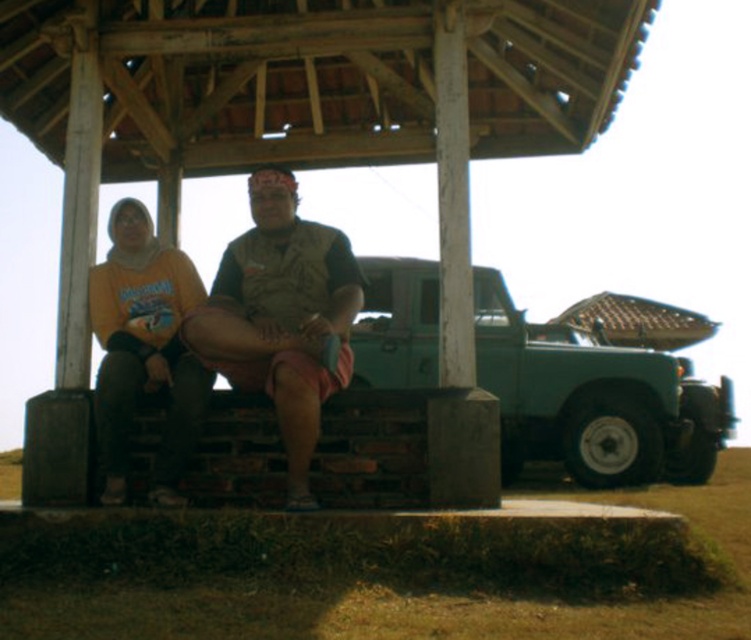
From the picture: Can you confirm if camouflage fabric shirt at center is shorter than matte yellow hoodie at left?

No, camouflage fabric shirt at center is not shorter than matte yellow hoodie at left.

Measure the distance from camouflage fabric shirt at center to matte yellow hoodie at left.

A distance of 1.48 meters exists between camouflage fabric shirt at center and matte yellow hoodie at left.

Is point (288, 202) behind point (106, 305)?

Yes, point (288, 202) is behind point (106, 305).

Where is `camouflage fabric shirt at center`? This screenshot has height=640, width=751. camouflage fabric shirt at center is located at coordinates (282, 317).